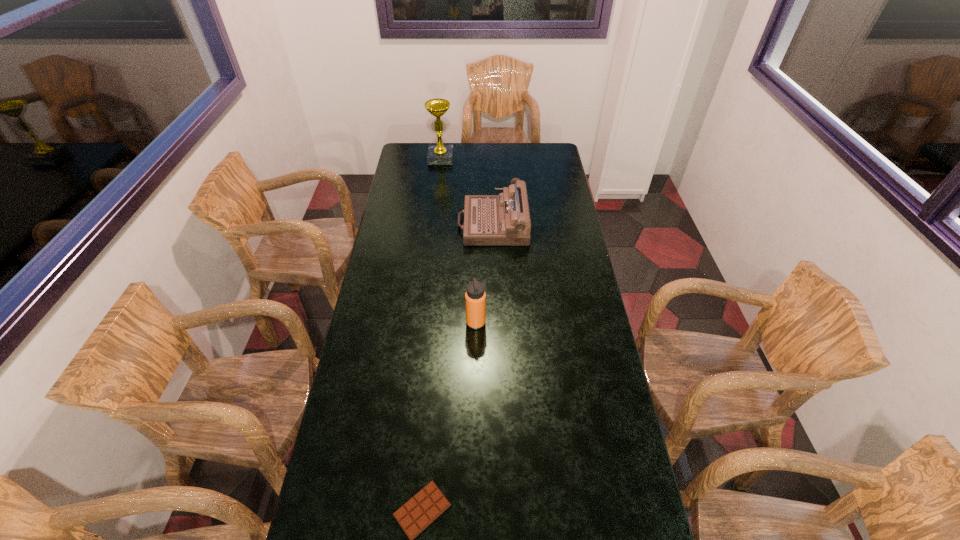
Locate an element on the screen. Image resolution: width=960 pixels, height=540 pixels. free location located on the keyboard of the second shortest object is located at coordinates (411, 224).

Locate an element on the screen. Image resolution: width=960 pixels, height=540 pixels. object present at the far edge is located at coordinates (439, 154).

You are a GUI agent. You are given a task and a screenshot of the screen. Output one action in this format:
    pyautogui.click(x=<x>, y=<y>)
    Task: Click on the object that is positioned at the left edge
    
    Given the screenshot: What is the action you would take?
    pyautogui.click(x=439, y=154)

This screenshot has width=960, height=540. In order to click on object that is at the far left corner in this screenshot , I will do `click(439, 154)`.

Find the location of `vacant space at the far edge`. vacant space at the far edge is located at coordinates (513, 156).

At what (x,y) coordinates should I click in order to perform the action: click on free space at the left edge of the desktop. Please return your answer as a coordinate pair (x, y). The image size is (960, 540). Looking at the image, I should click on [395, 198].

The width and height of the screenshot is (960, 540). I want to click on vacant region at the right edge of the desktop, so click(562, 287).

Where is `unoccupied position between the second shortest object and the award`? The width and height of the screenshot is (960, 540). unoccupied position between the second shortest object and the award is located at coordinates (467, 191).

Where is `free point between the third nearest object and the third farthest object`? This screenshot has height=540, width=960. free point between the third nearest object and the third farthest object is located at coordinates (484, 273).

Where is `blank region between the tallest object and the typewriter`? blank region between the tallest object and the typewriter is located at coordinates (467, 191).